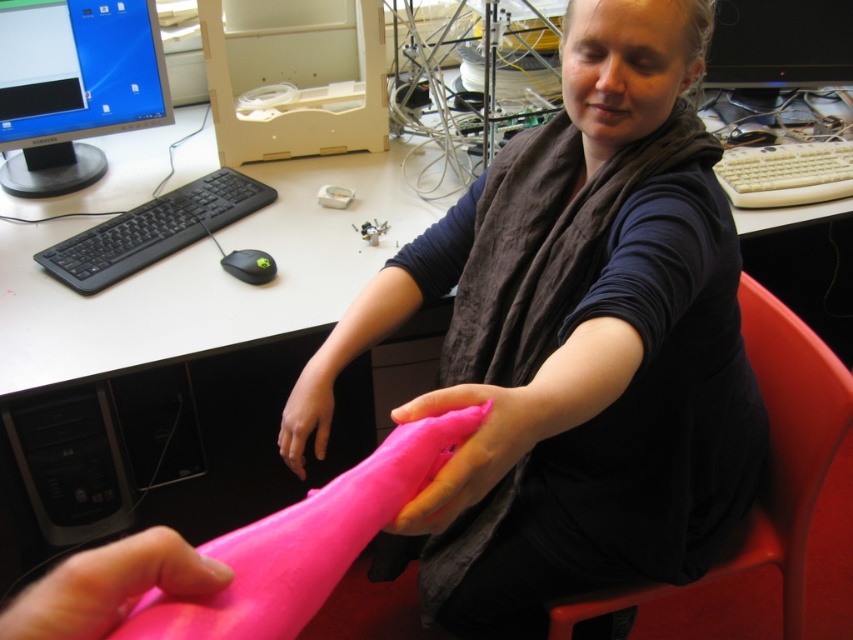
You are a delivery robot trying to navigate to a specific location in the workspace. You need to move from point A at point (798, 502) to point B at point (212, 589). According to the image, which direction should you move relative to the camera perspective?

You should move downward and to the right relative to the camera perspective because point (212, 589) is lower and further to the right compared to point (798, 502).